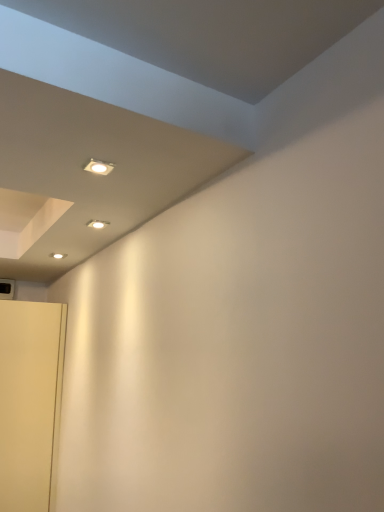
Question: Is white matte door at lower left closer to the viewer compared to matte white light fixture at upper center?

Choices:
 (A) no
 (B) yes

Answer: (A)

Question: Is white matte door at lower left positioned far away from matte white light fixture at upper center?

Choices:
 (A) no
 (B) yes

Answer: (B)

Question: Is white matte door at lower left looking in the opposite direction of matte white light fixture at upper center?

Choices:
 (A) no
 (B) yes

Answer: (A)

Question: Is white matte door at lower left to the left of matte white light fixture at upper center from the viewer's perspective?

Choices:
 (A) no
 (B) yes

Answer: (B)

Question: Does white matte door at lower left appear on the right side of matte white light fixture at upper center?

Choices:
 (A) yes
 (B) no

Answer: (B)

Question: Is white matte door at lower left thinner than matte white light fixture at upper center?

Choices:
 (A) yes
 (B) no

Answer: (B)

Question: Is matte white light fixture at upper center looking in the opposite direction of white matte door at lower left?

Choices:
 (A) no
 (B) yes

Answer: (A)

Question: Considering the relative positions of matte white light fixture at upper center and white matte door at lower left in the image provided, is matte white light fixture at upper center to the right of white matte door at lower left from the viewer's perspective?

Choices:
 (A) yes
 (B) no

Answer: (A)

Question: Does matte white light fixture at upper center have a smaller size compared to white matte door at lower left?

Choices:
 (A) no
 (B) yes

Answer: (B)

Question: From the image's perspective, is matte white light fixture at upper center below white matte door at lower left?

Choices:
 (A) yes
 (B) no

Answer: (B)

Question: Is matte white light fixture at upper center positioned before white matte door at lower left?

Choices:
 (A) yes
 (B) no

Answer: (A)

Question: Is the surface of matte white light fixture at upper center in direct contact with white matte door at lower left?

Choices:
 (A) yes
 (B) no

Answer: (B)

Question: From a real-world perspective, relative to white matte door at lower left, is matte white light fixture at upper center vertically above or below?

Choices:
 (A) below
 (B) above

Answer: (B)